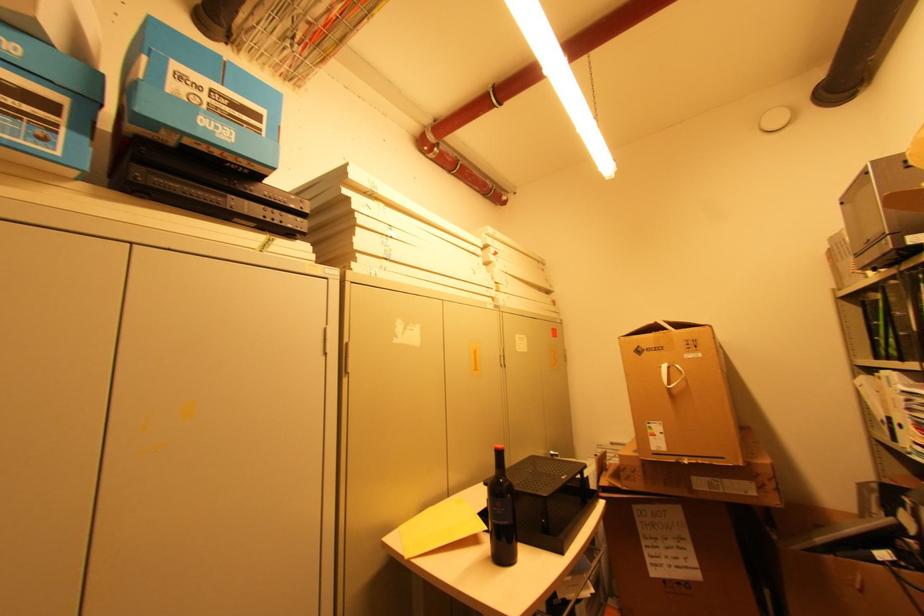
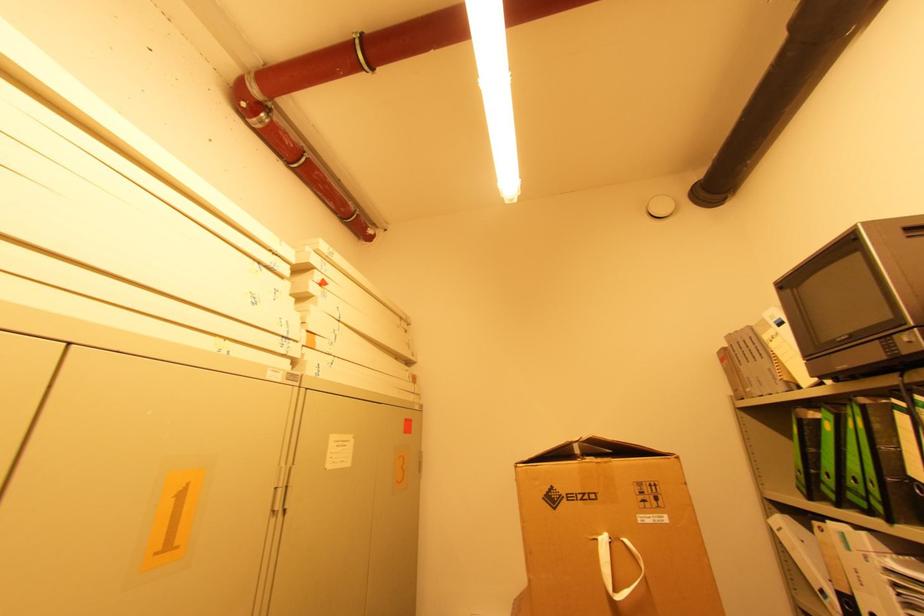
Question: I am providing you with two images of the same scene from different viewpoints. Which of the following objects are not visible in image2?

Choices:
 (A) black ring binder
 (B) white ring binder
 (C) metal cabinet handle
 (D) none of these

Answer: (D)